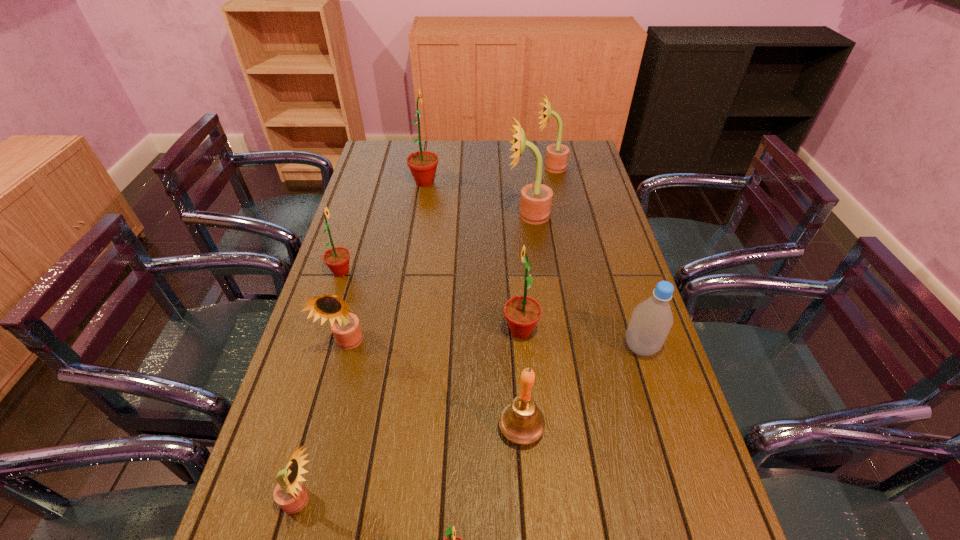
Locate an element on the screen. The image size is (960, 540). blank space located 0.160m on the face of the farthest yellow sunflower is located at coordinates (494, 167).

Image resolution: width=960 pixels, height=540 pixels. In order to click on free region located 0.350m on the face of the farthest yellow sunflower in this screenshot , I will do `click(447, 167)`.

This screenshot has width=960, height=540. What are the coordinates of `vacant area situated on the face of the third farthest green sunflower` in the screenshot? It's located at (476, 330).

The height and width of the screenshot is (540, 960). What are the coordinates of `free location located 0.140m on the face of the third farthest green sunflower` in the screenshot? It's located at (450, 330).

Where is `vacant area situated 0.400m on the face of the third farthest green sunflower`? vacant area situated 0.400m on the face of the third farthest green sunflower is located at coordinates (354, 330).

Where is `blank space located on the face of the third nearest green sunflower`? The height and width of the screenshot is (540, 960). blank space located on the face of the third nearest green sunflower is located at coordinates (433, 272).

Find the location of a particular element. This screenshot has height=540, width=960. vacant area situated on the face of the second nearest yellow sunflower is located at coordinates (315, 472).

Where is `free space located 0.160m on the left of the third nearest object`? This screenshot has height=540, width=960. free space located 0.160m on the left of the third nearest object is located at coordinates (427, 428).

Identify the location of vacant space positioned on the left of the gray bottle. [x=469, y=347].

The width and height of the screenshot is (960, 540). Find the location of `vacant area located 0.350m on the face of the seventh farthest sunflower`. vacant area located 0.350m on the face of the seventh farthest sunflower is located at coordinates (494, 500).